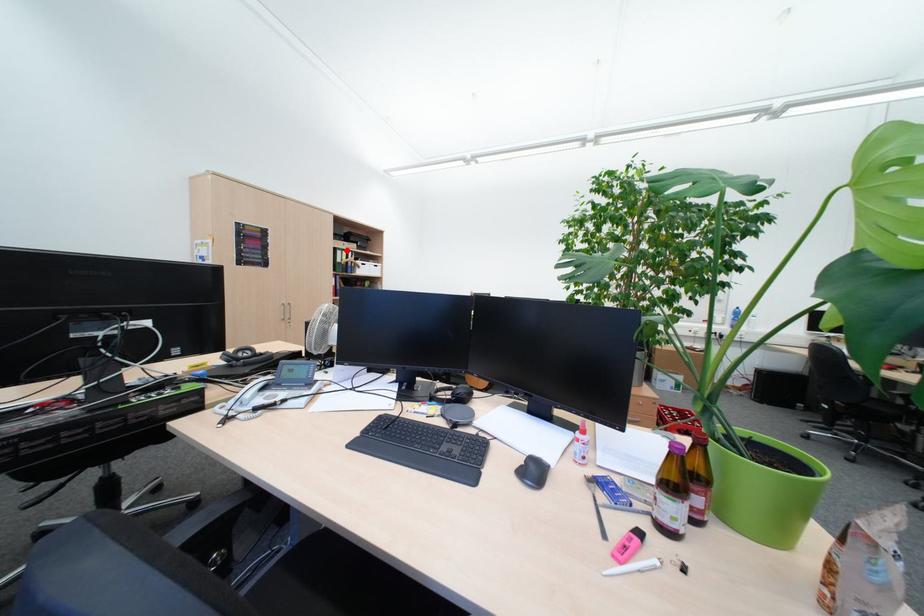
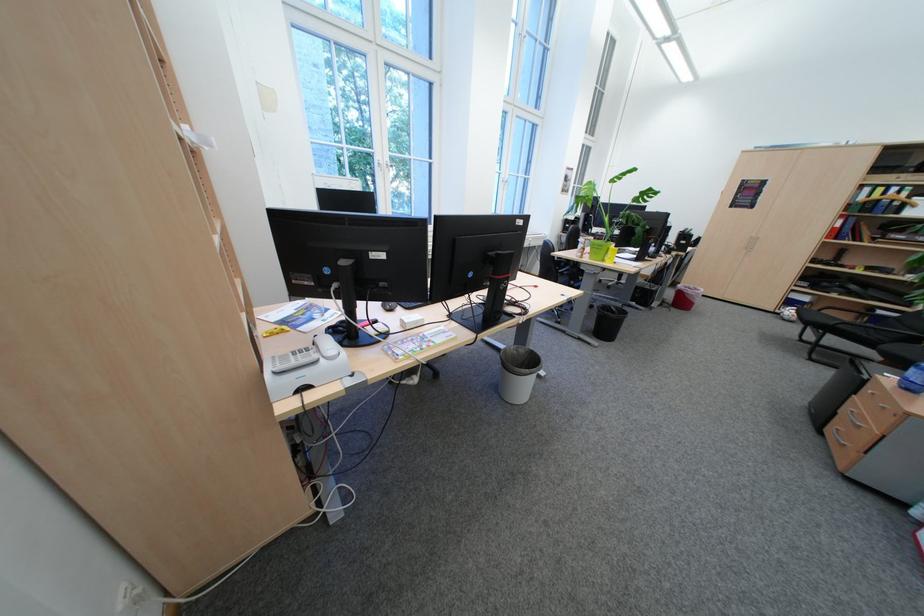
Find the pixel in the second image that matches the highlighted location in the first image.

(873, 188)